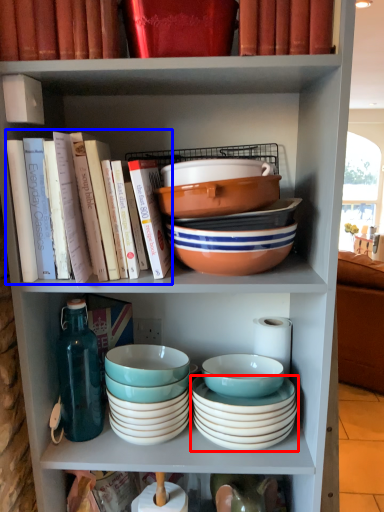
Question: Which point is further to the camera, bowl (highlighted by a red box) or book (highlighted by a blue box)?

Choices:
 (A) bowl
 (B) book

Answer: (A)